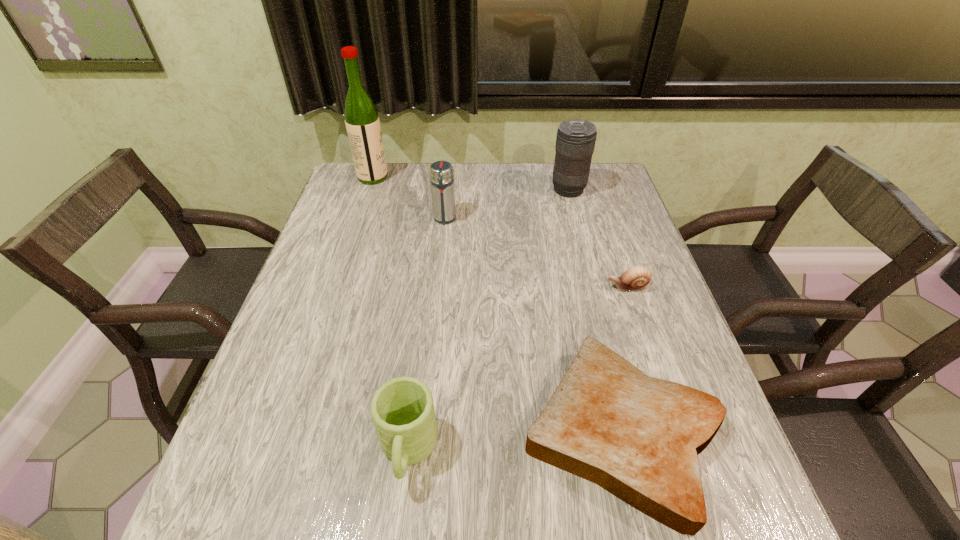
Where is `object located at the left edge`? object located at the left edge is located at coordinates pyautogui.click(x=362, y=122).

This screenshot has height=540, width=960. I want to click on telephoto lens present at the right edge, so click(575, 141).

Identify the location of escargot situated at the right edge. (636, 278).

Find the location of a particular element. The height and width of the screenshot is (540, 960). bread located at the right edge is located at coordinates (638, 437).

This screenshot has width=960, height=540. What are the coordinates of `object present at the far left corner` in the screenshot? It's located at (362, 122).

Locate an element on the screen. The image size is (960, 540). object positioned at the far right corner is located at coordinates (575, 141).

Locate an element on the screen. Image resolution: width=960 pixels, height=540 pixels. object that is at the near right corner is located at coordinates (638, 437).

What are the coordinates of `vacant space at the far edge` in the screenshot? It's located at (545, 177).

I want to click on blank space at the near edge, so click(x=394, y=535).

Find the location of a particular element. This screenshot has width=960, height=540. vacant space at the left edge of the desktop is located at coordinates (311, 348).